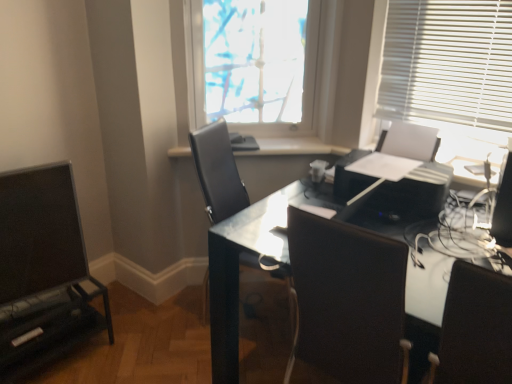
Where is `vacant space situated on the left part of black leather chair at center, positioned as the first chair in left-to-right order`? The height and width of the screenshot is (384, 512). vacant space situated on the left part of black leather chair at center, positioned as the first chair in left-to-right order is located at coordinates (164, 328).